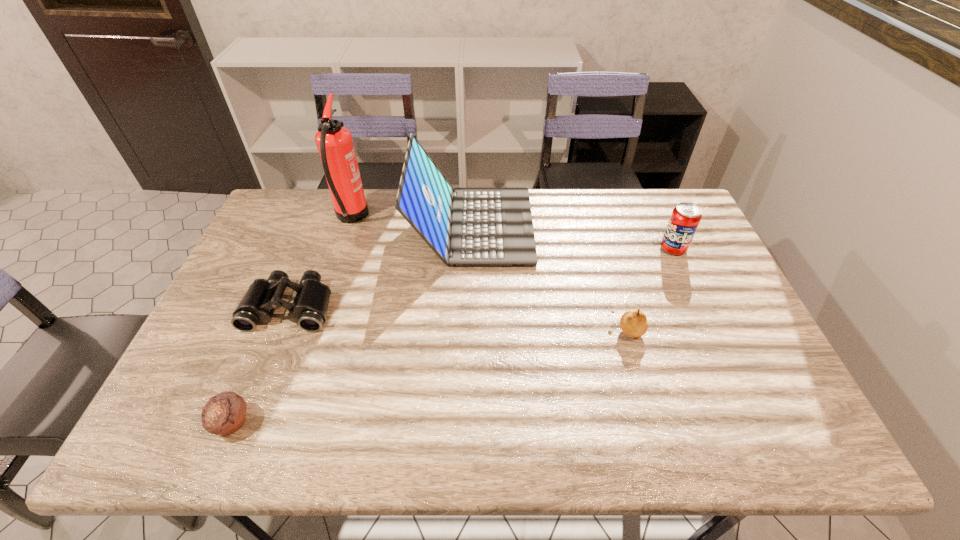
Image resolution: width=960 pixels, height=540 pixels. In order to click on vacant area that lies between the laptop computer and the binoculars in this screenshot , I will do `click(381, 266)`.

Identify the location of vacant point located between the pear and the binoculars. (459, 319).

You are a GUI agent. You are given a task and a screenshot of the screen. Output one action in this format:
    pyautogui.click(x=<x>, y=<y>)
    Task: Click on the unoccupied area between the pear and the nearest object
    The image size is (960, 540).
    Given the screenshot: What is the action you would take?
    pyautogui.click(x=430, y=376)

At what (x,y) coordinates should I click in order to perform the action: click on free space between the rightmost object and the pear. Please return your answer as a coordinate pair (x, y). This screenshot has width=960, height=540. Looking at the image, I should click on (650, 289).

Locate an element on the screen. The image size is (960, 540). unoccupied area between the second object from right to left and the third tallest object is located at coordinates tap(650, 289).

Where is `free space between the fire extinguisher and the binoculars`? free space between the fire extinguisher and the binoculars is located at coordinates (321, 262).

Select which object appears as the second closest to the binoculars. Please provide its 2D coordinates. Your answer should be formatted as a tuple, i.e. [(x, y)], where the tuple contains the x and y coordinates of a point satisfying the conditions above.

[(334, 142)]

The height and width of the screenshot is (540, 960). Identify the location of object that is the third closest to the fire extinguisher. (225, 413).

Where is `vacant space that satisfies the following two spatial constraints: 1. on the screen of the laptop computer; 2. on the right side of the pear`? vacant space that satisfies the following two spatial constraints: 1. on the screen of the laptop computer; 2. on the right side of the pear is located at coordinates (469, 330).

The height and width of the screenshot is (540, 960). Find the location of `free point that satisfies the following two spatial constraints: 1. on the front-facing side of the pear; 2. on the left side of the binoculars`. free point that satisfies the following two spatial constraints: 1. on the front-facing side of the pear; 2. on the left side of the binoculars is located at coordinates (281, 330).